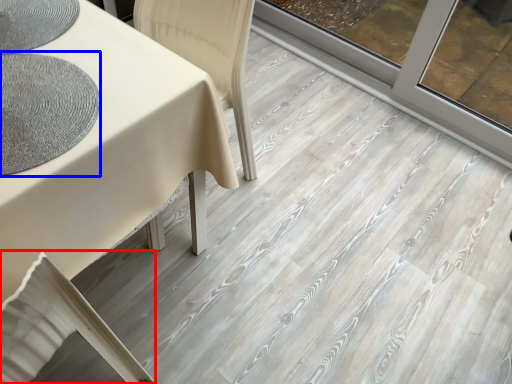
Question: Which object is further to the camera taking this photo, swivel chair (highlighted by a red box) or mat (highlighted by a blue box)?

Choices:
 (A) swivel chair
 (B) mat

Answer: (B)